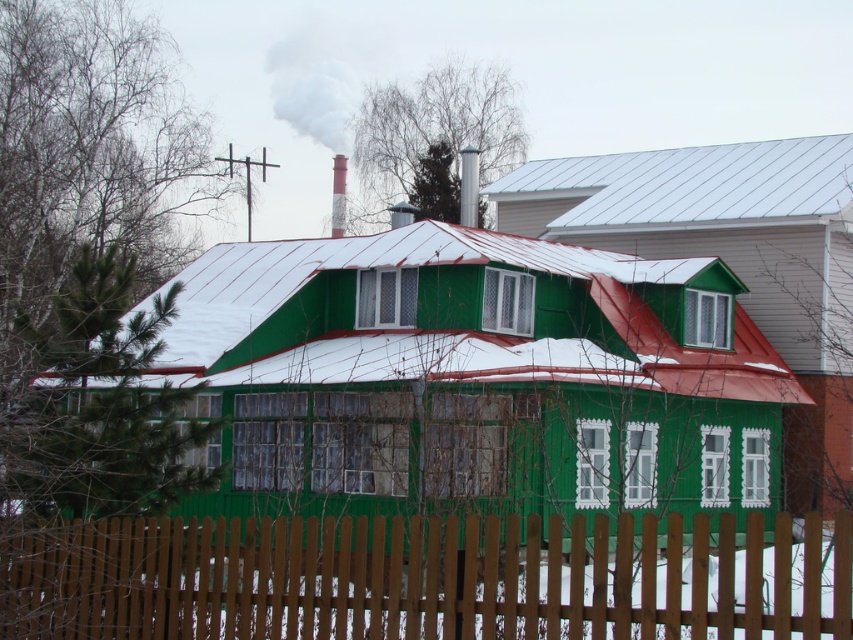
You are standing in front of the house and want to walk towards the metallic silver roof at upper center. Which direction should you move relative to the brown wooden fence at lower center?

The brown wooden fence at lower center is to the left of the metallic silver roof at upper center, so you should move to the right relative to the brown wooden fence at lower center to reach the metallic silver roof at upper center.

You are standing in front of the house and notice the brown wooden fence at lower center and the green painted wood at center. Which object is positioned to the right of the other?

The brown wooden fence at lower center is to the right of the green painted wood at center.

You are standing at the point closest to the house. Which point, point (654,163) or point (329,67), is closer to you?

Point (329,67) is closer to you because it is behind point (654,163).